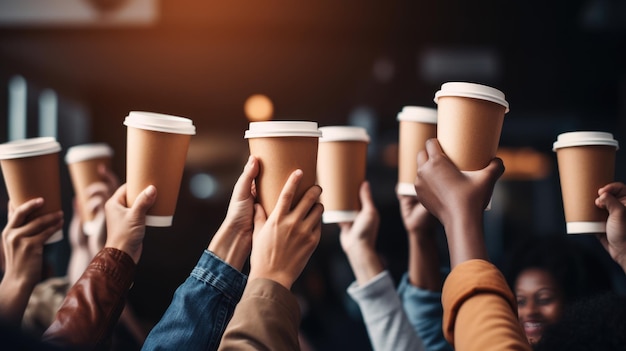
The height and width of the screenshot is (351, 626). What are the coordinates of `cups` in the screenshot? It's located at click(x=44, y=185), click(x=81, y=177), click(x=155, y=170), click(x=272, y=168), click(x=340, y=161), click(x=414, y=142), click(x=461, y=127), click(x=586, y=183).